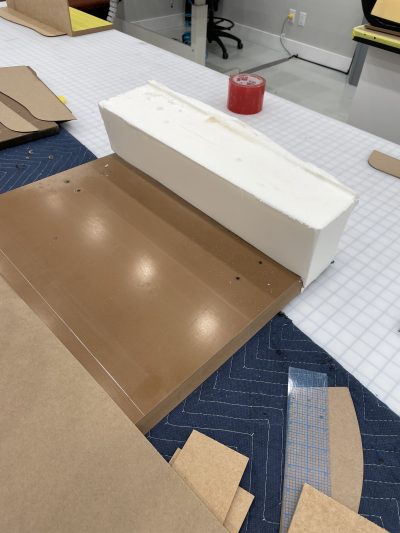
You are a GUI agent. You are given a task and a screenshot of the screen. Output one action in this format:
    pyautogui.click(x=<x>, y=<y>)
    Task: Click on the floor
    The height and width of the screenshot is (533, 400).
    Given the screenshot: What is the action you would take?
    pyautogui.click(x=326, y=93)